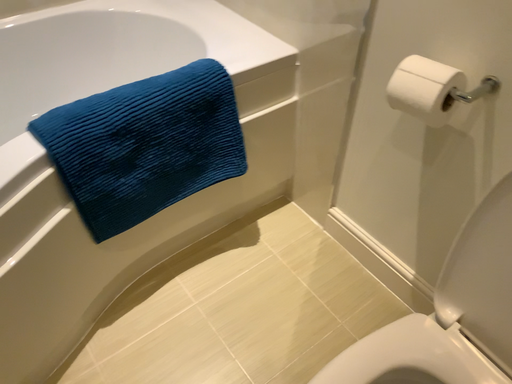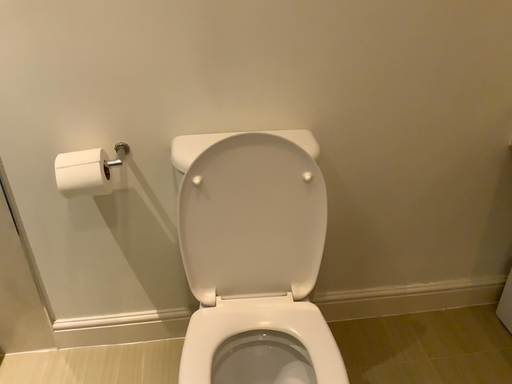
Question: How did the camera likely rotate when shooting the video?

Choices:
 (A) rotated downward
 (B) rotated upward

Answer: (B)